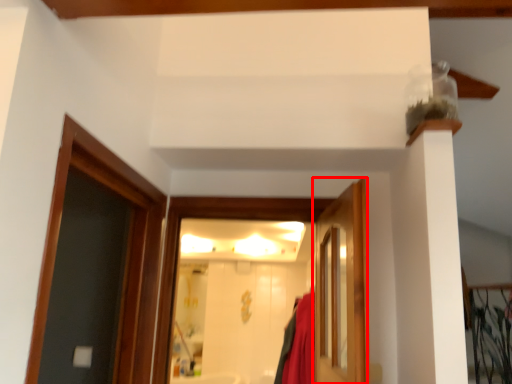
Question: Where is door (annotated by the red box) located in relation to door in the image?

Choices:
 (A) left
 (B) right

Answer: (B)